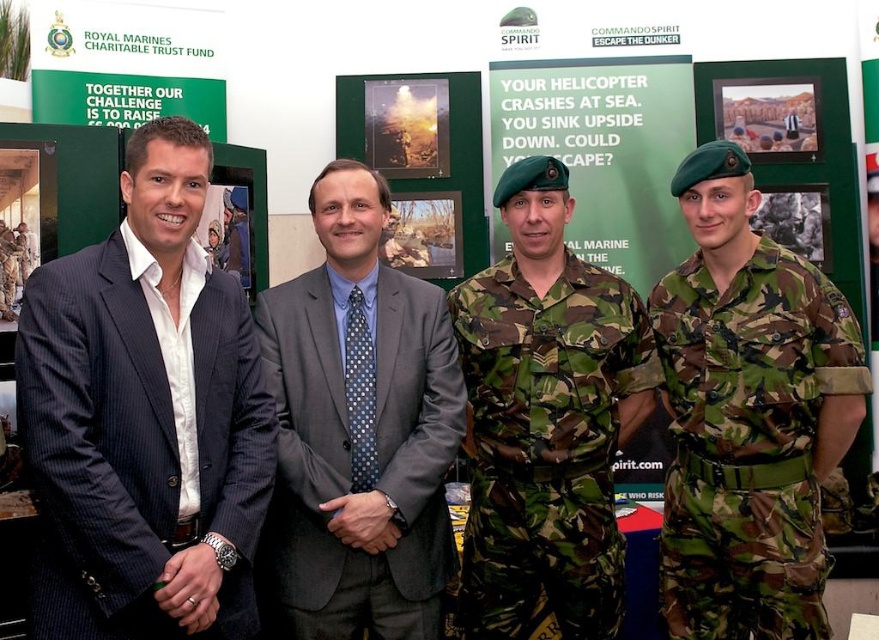
Question: Which object appears closest to the camera in this image?

Choices:
 (A) dark blue pinstripe suit at left
 (B) camouflage uniform at right
 (C) green camouflage poster at center

Answer: (A)

Question: Considering the real-world distances, which object is closest to the gray suit at center?

Choices:
 (A) green camouflage poster at center
 (B) camouflage uniform at right

Answer: (B)

Question: Does dark blue pinstripe suit at left appear on the left side of camouflage uniform at right?

Choices:
 (A) yes
 (B) no

Answer: (A)

Question: Does dark blue pinstripe suit at left have a greater width compared to camouflage uniform at right?

Choices:
 (A) no
 (B) yes

Answer: (B)

Question: Which of the following is the farthest from the observer?

Choices:
 (A) pyautogui.click(x=154, y=490)
 (B) pyautogui.click(x=578, y=323)

Answer: (B)

Question: Is gray suit at center positioned at the back of camouflage fabric uniform at center?

Choices:
 (A) no
 (B) yes

Answer: (A)